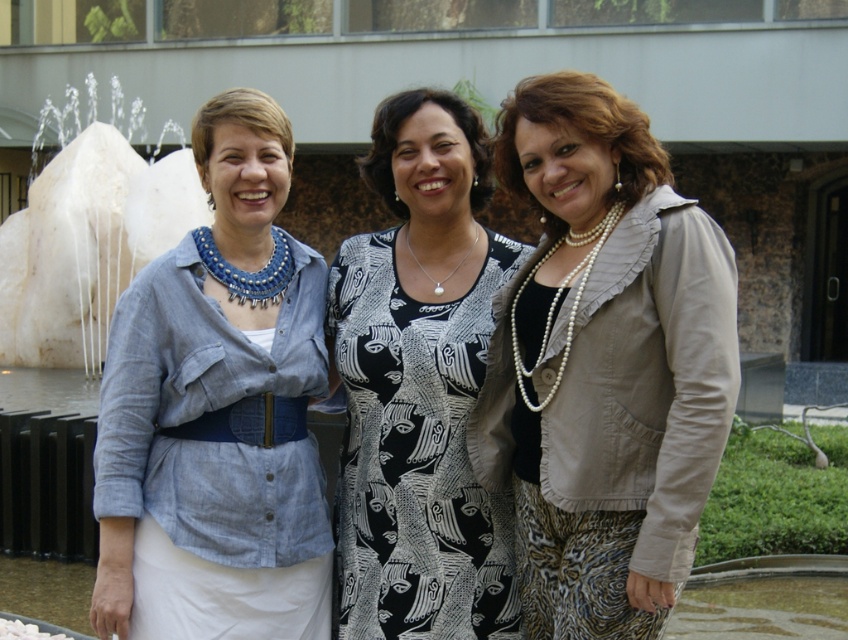
Who is positioned more to the right, pearl fabric jacket at center or white marble fountain at left?

pearl fabric jacket at center

Between pearl fabric jacket at center and white marble fountain at left, which one appears on the left side from the viewer's perspective?

Positioned to the left is white marble fountain at left.

The width and height of the screenshot is (848, 640). What do you see at coordinates (604, 364) in the screenshot? I see `pearl fabric jacket at center` at bounding box center [604, 364].

Where is `pearl fabric jacket at center`? pearl fabric jacket at center is located at coordinates (604, 364).

Who is shorter, pearl fabric jacket at center or black printed fabric dress at center?

Standing shorter between the two is black printed fabric dress at center.

Which is more to the left, pearl fabric jacket at center or black printed fabric dress at center?

From the viewer's perspective, black printed fabric dress at center appears more on the left side.

Between point (611, 192) and point (466, 576), which one is positioned in front?

Point (611, 192) is more forward.

The height and width of the screenshot is (640, 848). Find the location of `pearl fabric jacket at center`. pearl fabric jacket at center is located at coordinates (604, 364).

Consider the image. Can you confirm if black printed fabric dress at center is shorter than white marble fountain at left?

Yes, black printed fabric dress at center is shorter than white marble fountain at left.

Is the position of black printed fabric dress at center more distant than that of white marble fountain at left?

No, it is in front of white marble fountain at left.

At what (x,y) coordinates should I click in order to perform the action: click on black printed fabric dress at center. Please return your answer as a coordinate pair (x, y). The image size is (848, 640). Looking at the image, I should click on (416, 452).